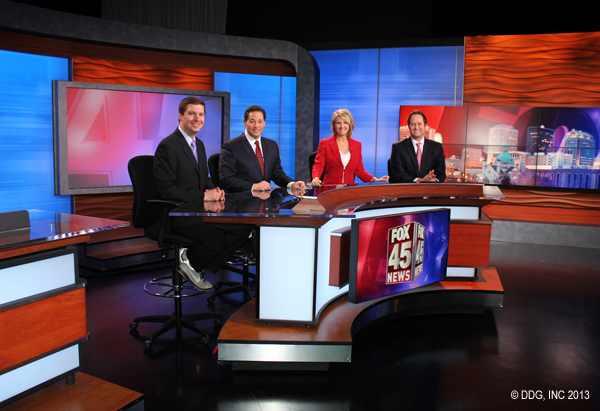
This screenshot has width=600, height=411. I want to click on television screen, so click(x=91, y=110).